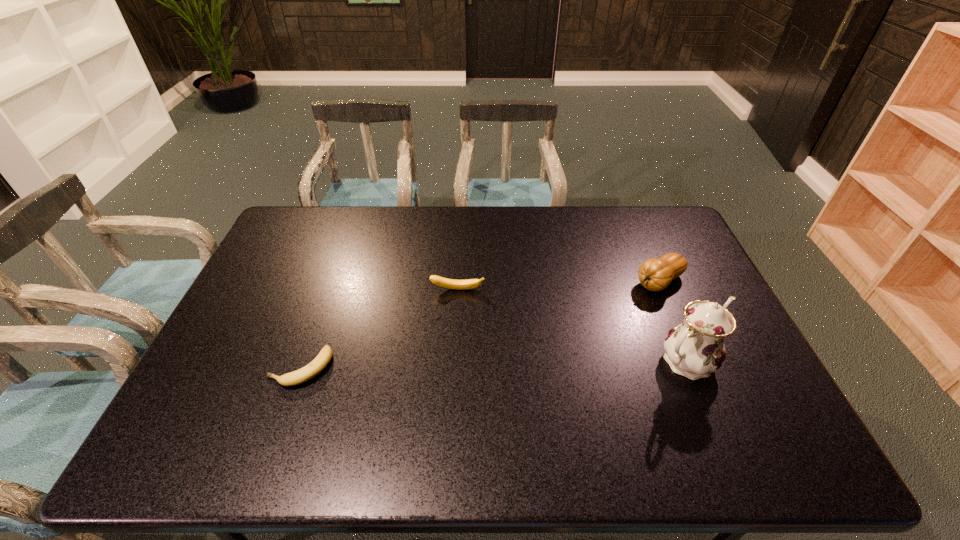
Locate an element on the screen. This screenshot has width=960, height=540. vacant area at the far left corner of the desktop is located at coordinates (300, 237).

Find the location of a particular element. free space at the near left corner of the desktop is located at coordinates (215, 408).

The width and height of the screenshot is (960, 540). Identify the location of free space that is in between the gourd and the shortest object. (480, 325).

Where is `empty space that is in between the second shortest object and the third shortest object`? The image size is (960, 540). empty space that is in between the second shortest object and the third shortest object is located at coordinates (558, 285).

You are a GUI agent. You are given a task and a screenshot of the screen. Output one action in this format:
    pyautogui.click(x=<x>, y=<y>)
    Task: Click on the free spot between the third object from right to left and the shortest object
    Image resolution: width=960 pixels, height=540 pixels.
    Given the screenshot: What is the action you would take?
    [379, 328]

The width and height of the screenshot is (960, 540). I want to click on free space between the tallest object and the right banana, so click(571, 325).

Locate an element on the screen. free space between the tallest object and the shorter banana is located at coordinates (493, 364).

Locate an element on the screen. free point between the chinaware and the second tallest object is located at coordinates (672, 321).

Find the location of a particular element. This screenshot has height=540, width=960. vacant point located between the chinaware and the left banana is located at coordinates (493, 364).

This screenshot has height=540, width=960. Identify the location of free spot between the second shortest object and the leftmost object. (379, 328).